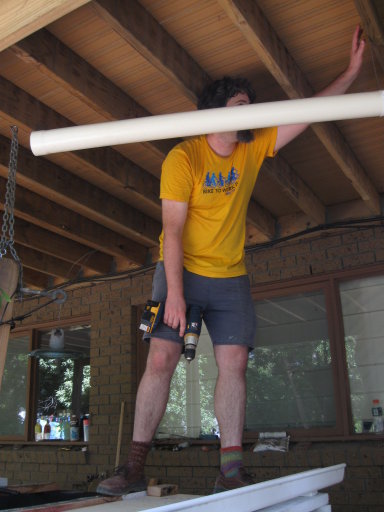
Where is `wall`? The image size is (384, 512). wall is located at coordinates (114, 376), (337, 248), (364, 475), (87, 303), (22, 461).